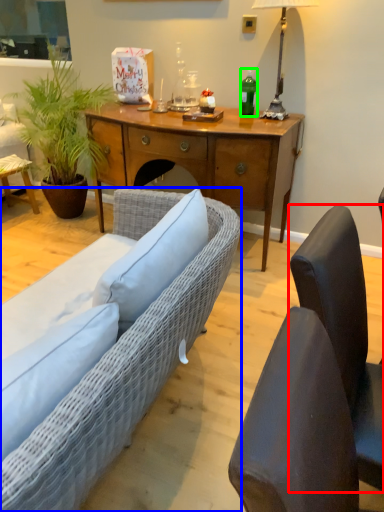
Question: Which object is positioned closest to chair (highlighted by a red box)? Select from studio couch (highlighted by a blue box) and bottle (highlighted by a green box).

Choices:
 (A) studio couch
 (B) bottle

Answer: (A)